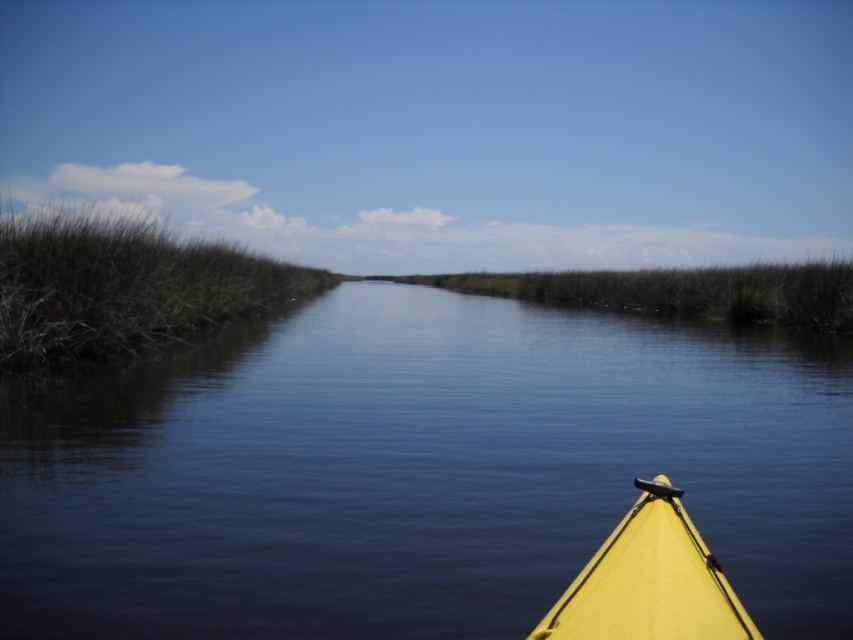
Can you confirm if smooth water at center is positioned above yellow matte kayak at lower right?

Correct, smooth water at center is located above yellow matte kayak at lower right.

Between smooth water at center and yellow matte kayak at lower right, which one is positioned higher?

smooth water at center is higher up.

Where is `smooth water at center`? Image resolution: width=853 pixels, height=640 pixels. smooth water at center is located at coordinates (418, 470).

Identify the location of smooth water at center. (418, 470).

Does smooth water at center appear on the right side of brown grass at left?

Correct, you'll find smooth water at center to the right of brown grass at left.

Is the position of smooth water at center more distant than that of brown grass at left?

No, smooth water at center is closer to the viewer.

You are a GUI agent. You are given a task and a screenshot of the screen. Output one action in this format:
    pyautogui.click(x=<x>, y=<y>)
    Task: Click on the smooth water at center
    
    Given the screenshot: What is the action you would take?
    pyautogui.click(x=418, y=470)

The width and height of the screenshot is (853, 640). Find the location of `smooth water at center`. smooth water at center is located at coordinates (418, 470).

Which is behind, point (4, 332) or point (654, 614)?

The point (4, 332) is behind.

Can you confirm if brown grass at left is positioned to the left of yellow matte kayak at lower right?

Correct, you'll find brown grass at left to the left of yellow matte kayak at lower right.

Measure the distance between point (80, 216) and camera.

Point (80, 216) is 20.77 meters from camera.

This screenshot has height=640, width=853. Find the location of `brown grass at left`. brown grass at left is located at coordinates tap(122, 285).